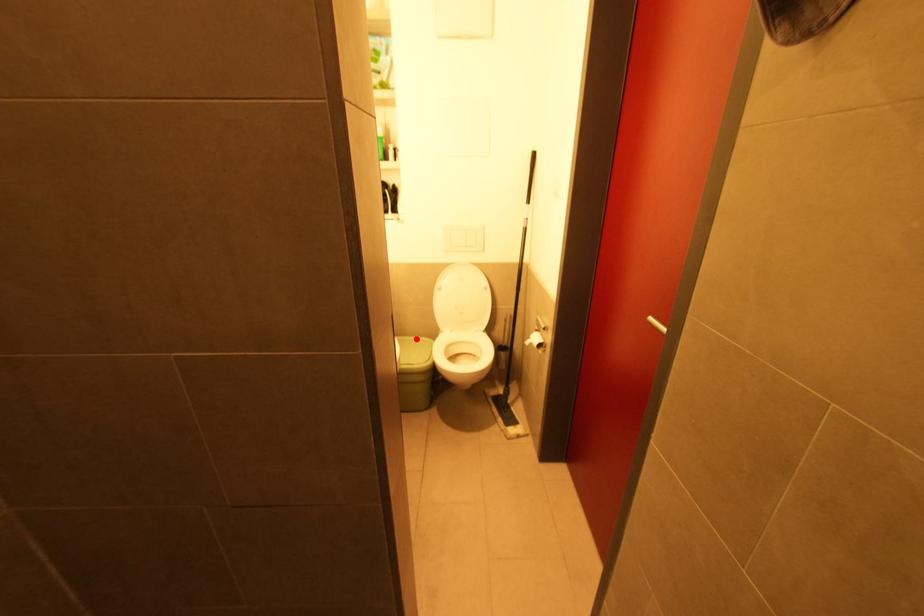
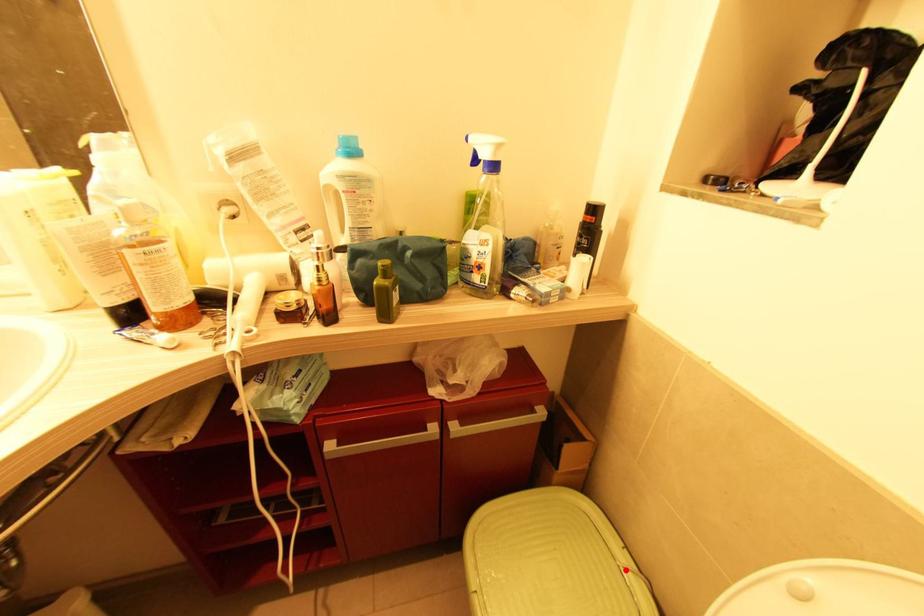
I am providing you with two images of the same scene from different viewpoints. A red point is marked on the first image and another point is marked on the second image. Are the points marked in image1 and image2 representing the same 3D position?

Yes